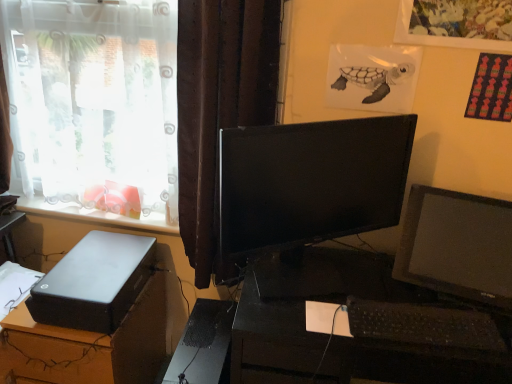
In order to click on vacant region above black plastic desk at center, the second desk from the left (from a real-world perspective) in this screenshot , I will do `click(384, 301)`.